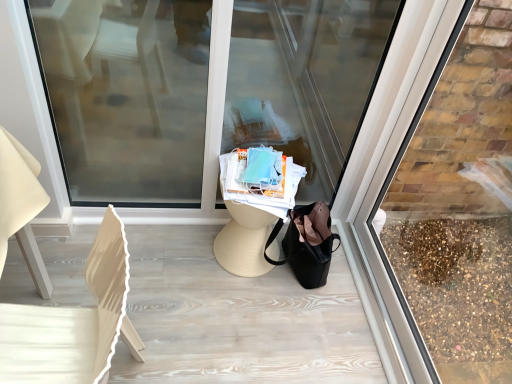
Question: From a real-world perspective, is transparent glass at right, the first shop window in the right-to-left sequence, on transparent glass shop window at center, the second shop window positioned from the right?

Choices:
 (A) yes
 (B) no

Answer: (A)

Question: Can you confirm if transparent glass at right, which ranks as the 2th shop window in left-to-right order, is thinner than transparent glass shop window at center, marked as the 1th shop window in a left-to-right arrangement?

Choices:
 (A) no
 (B) yes

Answer: (B)

Question: Does transparent glass at right, which ranks as the 2th shop window in left-to-right order, appear on the left side of transparent glass shop window at center, marked as the 1th shop window in a left-to-right arrangement?

Choices:
 (A) yes
 (B) no

Answer: (B)

Question: Is transparent glass at right, which ranks as the 2th shop window in left-to-right order, not close to transparent glass shop window at center, the second shop window positioned from the right?

Choices:
 (A) no
 (B) yes

Answer: (A)

Question: Is transparent glass at right, which ranks as the 2th shop window in left-to-right order, located outside transparent glass shop window at center, marked as the 1th shop window in a left-to-right arrangement?

Choices:
 (A) no
 (B) yes

Answer: (B)

Question: Is the position of transparent glass at right, which ranks as the 2th shop window in left-to-right order, more distant than that of transparent glass shop window at center, marked as the 1th shop window in a left-to-right arrangement?

Choices:
 (A) no
 (B) yes

Answer: (A)

Question: Does transparent glass shop window at center, marked as the 1th shop window in a left-to-right arrangement, contain transparent glass at right, which ranks as the 2th shop window in left-to-right order?

Choices:
 (A) no
 (B) yes

Answer: (A)

Question: Is transparent glass shop window at center, the second shop window positioned from the right, turned away from transparent glass at right, the first shop window in the right-to-left sequence?

Choices:
 (A) no
 (B) yes

Answer: (A)

Question: Does transparent glass shop window at center, marked as the 1th shop window in a left-to-right arrangement, have a larger size compared to transparent glass at right, which ranks as the 2th shop window in left-to-right order?

Choices:
 (A) no
 (B) yes

Answer: (B)

Question: From the image's perspective, is transparent glass shop window at center, the second shop window positioned from the right, located beneath transparent glass at right, which ranks as the 2th shop window in left-to-right order?

Choices:
 (A) no
 (B) yes

Answer: (A)

Question: Is transparent glass shop window at center, the second shop window positioned from the right, thinner than transparent glass at right, which ranks as the 2th shop window in left-to-right order?

Choices:
 (A) yes
 (B) no

Answer: (B)

Question: Is transparent glass shop window at center, the second shop window positioned from the right, touching transparent glass at right, which ranks as the 2th shop window in left-to-right order?

Choices:
 (A) no
 (B) yes

Answer: (A)

Question: Is transparent glass shop window at center, marked as the 1th shop window in a left-to-right arrangement, outside of white wood chair at left?

Choices:
 (A) yes
 (B) no

Answer: (A)